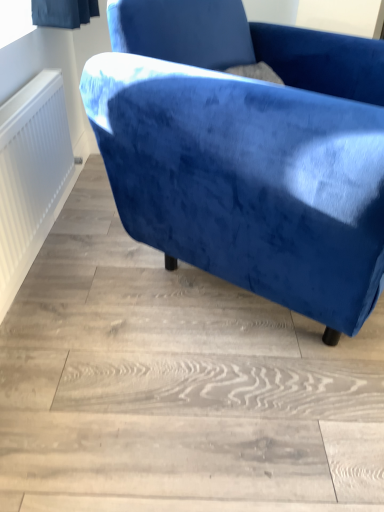
The image size is (384, 512). I want to click on vacant region to the right of white textured radiator at left, so click(x=135, y=262).